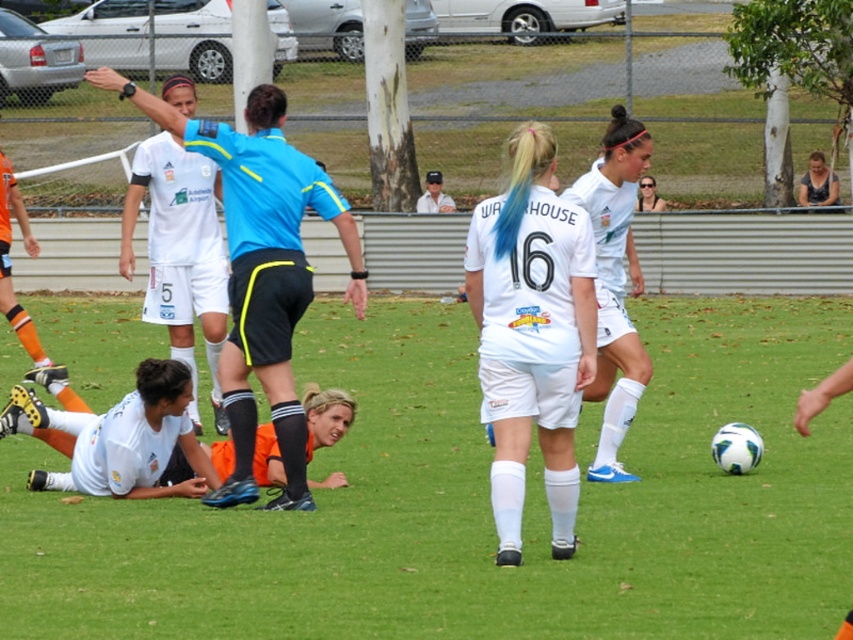
Question: Among these points, which one is farthest from the camera?

Choices:
 (A) (263, 248)
 (B) (223, 339)
 (C) (508, 394)

Answer: (B)

Question: Which point is farther from the camera taking this photo?

Choices:
 (A) pos(425,182)
 (B) pos(102,305)

Answer: (A)

Question: Which point is closer to the camera?

Choices:
 (A) blue short-sleeved shirt at upper center
 (B) white matte jersey at upper left
 (C) white matte soccer ball at center

Answer: (C)

Question: In this image, where is blue short-sleeved shirt at upper center located relative to white matte jersey at upper left?

Choices:
 (A) left
 (B) right

Answer: (B)

Question: Can you confirm if white matte jersey at center is positioned to the left of white cap at center?

Choices:
 (A) no
 (B) yes

Answer: (A)

Question: Is blue short-sleeved shirt at upper center to the right of white matte jersey at upper left from the viewer's perspective?

Choices:
 (A) no
 (B) yes

Answer: (B)